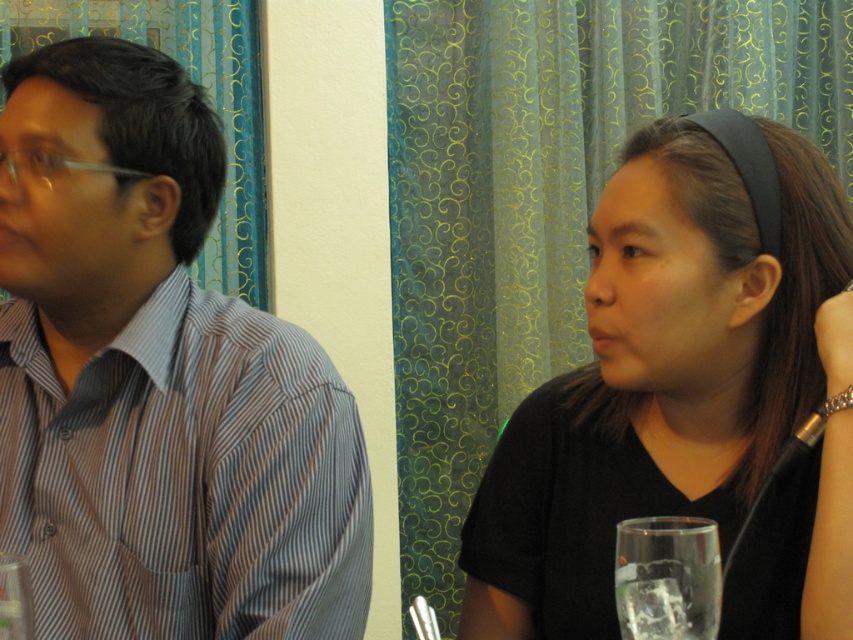
Question: Observing the image, what is the correct spatial positioning of black matte shirt at center in reference to clear glass at lower left?

Choices:
 (A) above
 (B) below

Answer: (A)

Question: Which is nearer to the clear glass at lower left?

Choices:
 (A) clear glass at lower right
 (B) black matte shirt at center
 (C) striped cotton shirt at left

Answer: (C)

Question: Among these objects, which one is nearest to the camera?

Choices:
 (A) clear glass at lower right
 (B) black matte shirt at center
 (C) clear glass at lower left

Answer: (C)

Question: Is striped cotton shirt at left smaller than clear glass at lower right?

Choices:
 (A) no
 (B) yes

Answer: (A)

Question: Based on their relative distances, which object is farther from the black matte shirt at center?

Choices:
 (A) clear glass at lower left
 (B) clear glass at lower right
 (C) striped cotton shirt at left

Answer: (A)

Question: Is striped cotton shirt at left thinner than clear glass at lower right?

Choices:
 (A) no
 (B) yes

Answer: (A)